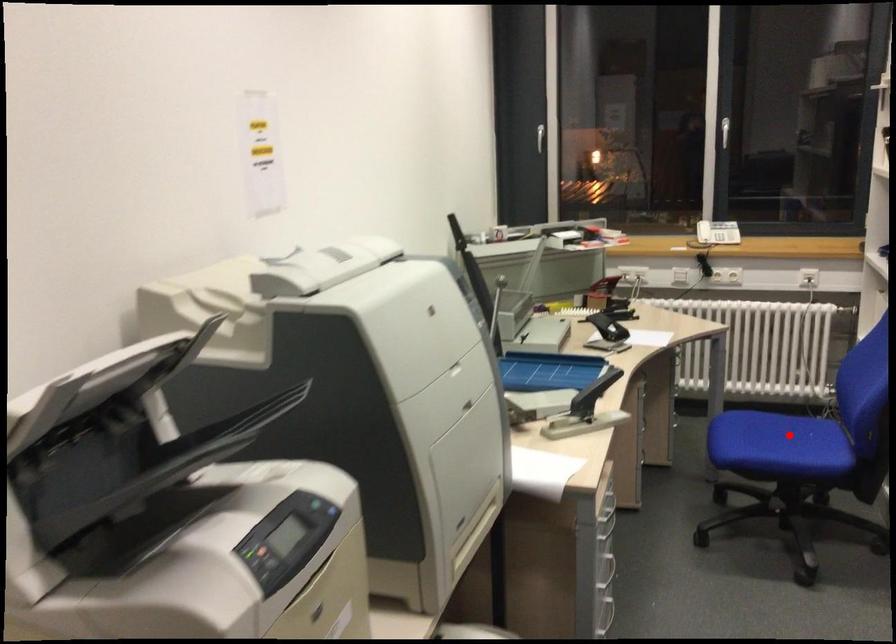
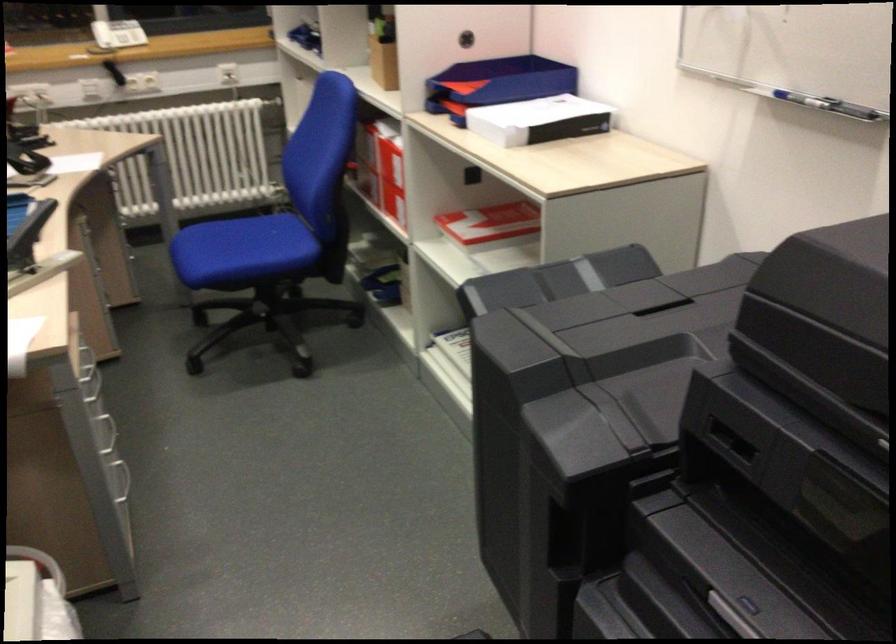
The point at the highlighted location is marked in the first image. Where is the corresponding point in the second image?

(254, 241)